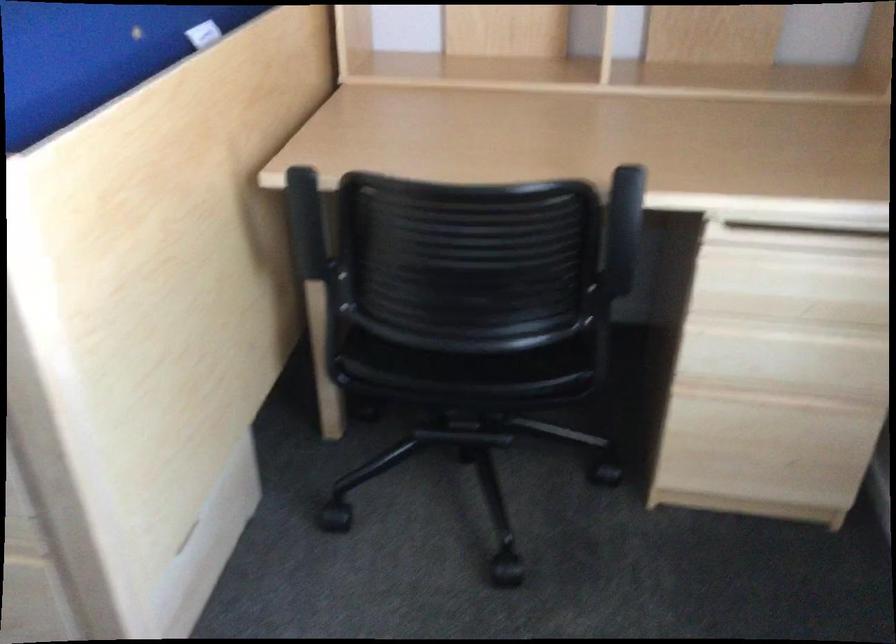
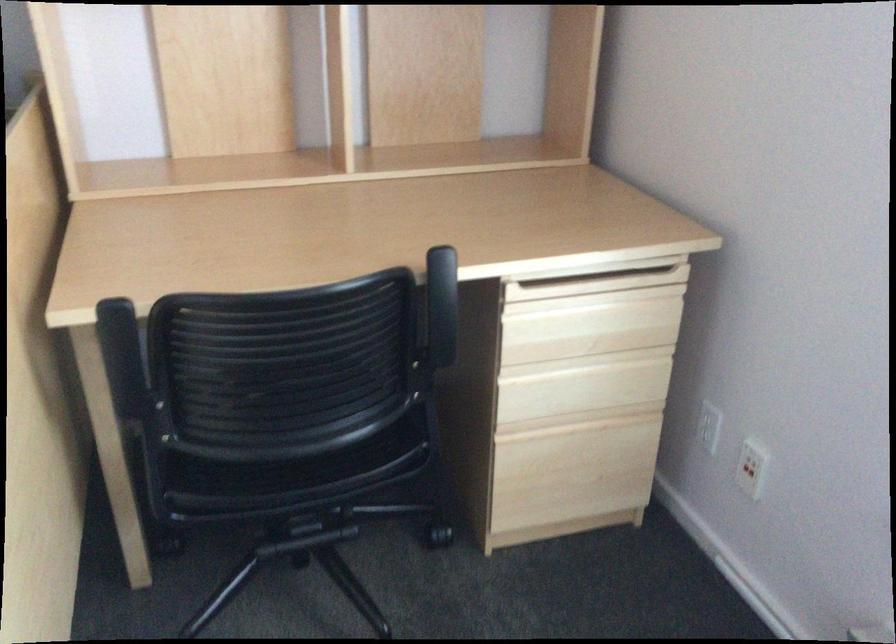
In the second image, find the point that corresponds to point 622,234 in the first image.

(441, 306)